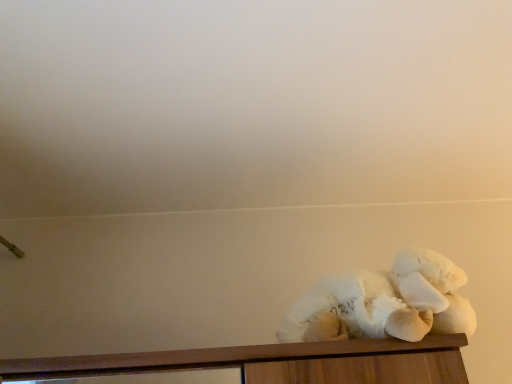
Question: Does white fluffy teddy bear at right have a lesser width compared to wooden cabinet at lower right?

Choices:
 (A) no
 (B) yes

Answer: (B)

Question: Is white fluffy teddy bear at right wider than wooden cabinet at lower right?

Choices:
 (A) yes
 (B) no

Answer: (B)

Question: Considering the relative sizes of white fluffy teddy bear at right and wooden cabinet at lower right in the image provided, is white fluffy teddy bear at right bigger than wooden cabinet at lower right?

Choices:
 (A) yes
 (B) no

Answer: (B)

Question: From the image's perspective, would you say white fluffy teddy bear at right is shown under wooden cabinet at lower right?

Choices:
 (A) yes
 (B) no

Answer: (B)

Question: Is white fluffy teddy bear at right facing away from wooden cabinet at lower right?

Choices:
 (A) no
 (B) yes

Answer: (A)

Question: From a real-world perspective, does white fluffy teddy bear at right sit lower than wooden cabinet at lower right?

Choices:
 (A) no
 (B) yes

Answer: (A)

Question: Considering the relative sizes of wooden cabinet at lower right and white fluffy teddy bear at right in the image provided, is wooden cabinet at lower right wider than white fluffy teddy bear at right?

Choices:
 (A) no
 (B) yes

Answer: (B)

Question: From the image's perspective, is wooden cabinet at lower right located above white fluffy teddy bear at right?

Choices:
 (A) yes
 (B) no

Answer: (B)

Question: Is wooden cabinet at lower right not inside white fluffy teddy bear at right?

Choices:
 (A) no
 (B) yes

Answer: (B)

Question: Is wooden cabinet at lower right surrounding white fluffy teddy bear at right?

Choices:
 (A) yes
 (B) no

Answer: (B)

Question: Does wooden cabinet at lower right turn towards white fluffy teddy bear at right?

Choices:
 (A) yes
 (B) no

Answer: (B)

Question: From a real-world perspective, is wooden cabinet at lower right on white fluffy teddy bear at right?

Choices:
 (A) yes
 (B) no

Answer: (B)

Question: In terms of width, does white fluffy teddy bear at right look wider or thinner when compared to wooden cabinet at lower right?

Choices:
 (A) wide
 (B) thin

Answer: (B)